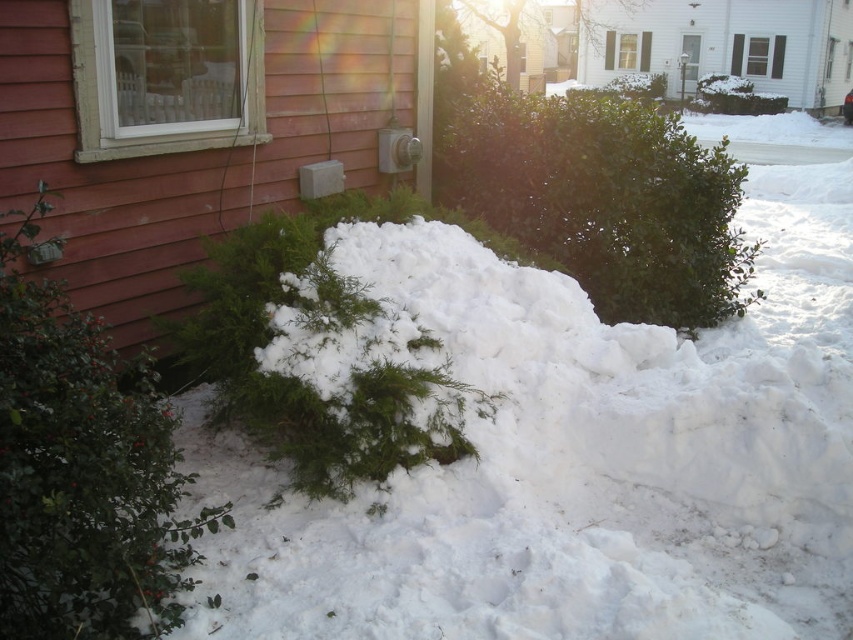
Question: Among these points, which one is farthest from the camera?

Choices:
 (A) (21, 360)
 (B) (611, 296)

Answer: (B)

Question: Can you confirm if green leafy bush at lower left is wider than green leafy bush at center?

Choices:
 (A) no
 (B) yes

Answer: (A)

Question: In this image, where is green leafy bush at lower left located relative to green leafy bush at center?

Choices:
 (A) below
 (B) above

Answer: (A)

Question: Is green leafy bush at lower left wider than green leafy bush at center?

Choices:
 (A) no
 (B) yes

Answer: (A)

Question: Which point is farther from the camera taking this photo?

Choices:
 (A) (674, 152)
 (B) (49, 566)

Answer: (A)